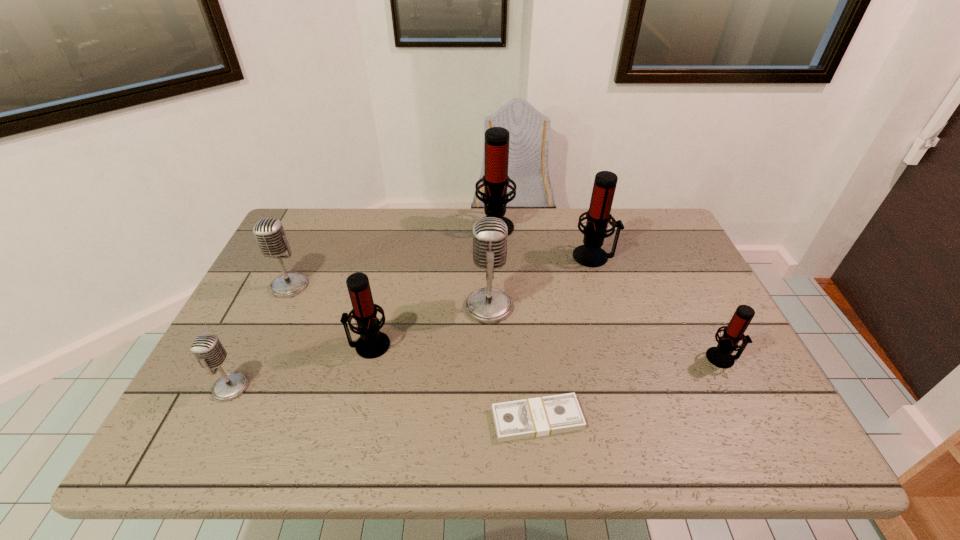
Locate which microphone ranks fifth in proximity to the second smallest red microphone. Please provide its 2D coordinates. Your answer should be formatted as a tuple, i.e. [(x, y)], where the tuple contains the x and y coordinates of a point satisfying the conditions above.

[(598, 216)]

Locate an element on the screen. Image resolution: width=960 pixels, height=540 pixels. red microphone that stands as the closest to the seventh nearest object is located at coordinates (495, 181).

Where is `the second closest red microphone to the farthest red microphone`? This screenshot has height=540, width=960. the second closest red microphone to the farthest red microphone is located at coordinates (372, 343).

Identify the location of gray microphone that is the nearest to the dollar. The height and width of the screenshot is (540, 960). (488, 305).

What are the coordinates of `gray microphone that is the closest to the farthest object` in the screenshot? It's located at (488, 305).

You are a GUI agent. You are given a task and a screenshot of the screen. Output one action in this format:
    pyautogui.click(x=<x>, y=<y>)
    Task: Click on the free space that satisfies the following two spatial constraints: 1. on the back side of the nearest microphone; 2. on the left side of the seventh object from left to right
    Image resolution: width=960 pixels, height=540 pixels.
    Given the screenshot: What is the action you would take?
    pyautogui.click(x=296, y=256)

In order to click on vacant space that satisfies the following two spatial constraints: 1. on the front side of the second biggest gray microphone; 2. on the left side of the third biggest red microphone in this screenshot , I will do `click(262, 345)`.

Where is `vacant area that satisfies the following two spatial constraints: 1. on the back side of the second object from right to left; 2. on the left side of the fifth microphone from right to left`? Image resolution: width=960 pixels, height=540 pixels. vacant area that satisfies the following two spatial constraints: 1. on the back side of the second object from right to left; 2. on the left side of the fifth microphone from right to left is located at coordinates (391, 256).

Where is `free spot that satisfies the following two spatial constraints: 1. on the back side of the nearest gray microphone; 2. on the left side of the second smallest gray microphone`? free spot that satisfies the following two spatial constraints: 1. on the back side of the nearest gray microphone; 2. on the left side of the second smallest gray microphone is located at coordinates (281, 286).

Find the location of a particular element. The width and height of the screenshot is (960, 540). free spot that satisfies the following two spatial constraints: 1. on the back side of the tallest microphone; 2. on the left side of the second smallest gray microphone is located at coordinates (319, 225).